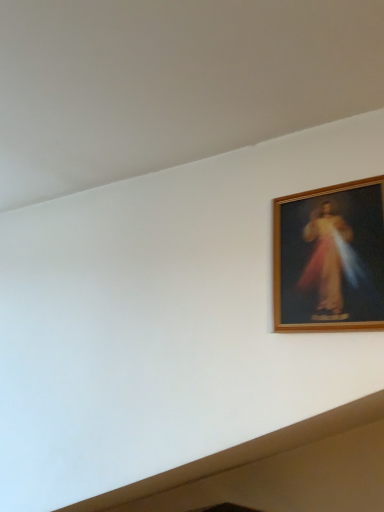
This screenshot has width=384, height=512. Describe the element at coordinates (330, 258) in the screenshot. I see `wooden frame at upper right` at that location.

Locate an element on the screen. wooden frame at upper right is located at coordinates (330, 258).

Identify the location of wooden frame at upper right. The height and width of the screenshot is (512, 384). (330, 258).